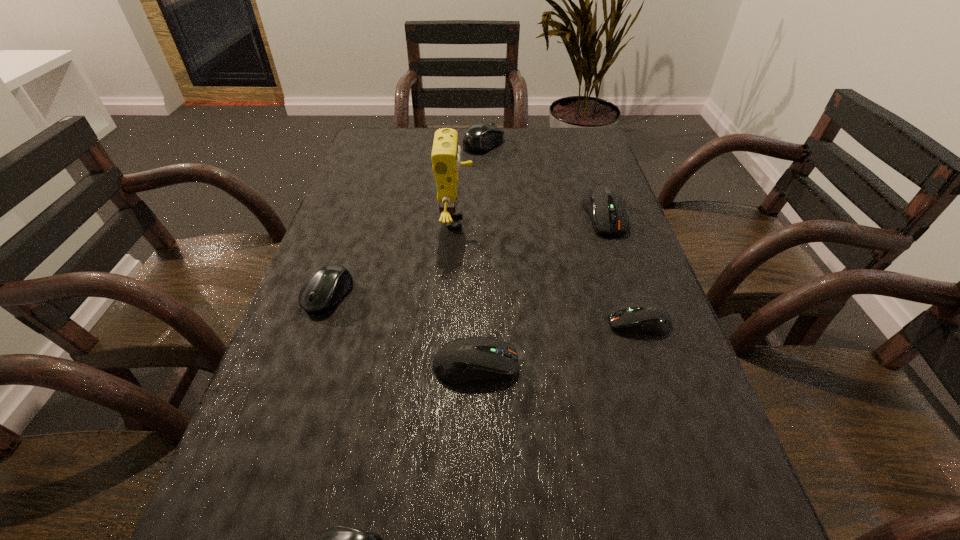
In order to click on sponge in this screenshot , I will do `click(446, 153)`.

Identify the location of the biggest black mouse. (480, 137).

This screenshot has height=540, width=960. What are the coordinates of `the farthest mouse` in the screenshot? It's located at [x=480, y=137].

Where is `the biggest dark computer equipment`? This screenshot has height=540, width=960. the biggest dark computer equipment is located at coordinates (606, 207).

You are a GUI agent. You are given a task and a screenshot of the screen. Output one action in this format:
    pyautogui.click(x=<x>, y=<y>)
    Task: Click on the farthest dark computer equipment
    Image resolution: width=960 pixels, height=540 pixels.
    Given the screenshot: What is the action you would take?
    pyautogui.click(x=606, y=207)

The image size is (960, 540). Find the location of `the second biggest black mouse`. the second biggest black mouse is located at coordinates (326, 287).

At what (x,y) coordinates should I click in order to perform the action: click on the leftmost mouse. Please return your answer as a coordinate pair (x, y). Image resolution: width=960 pixels, height=540 pixels. Looking at the image, I should click on (326, 287).

Find the location of a particular element. The height and width of the screenshot is (540, 960). the second biggest dark computer equipment is located at coordinates (463, 360).

What are the coordinates of `the nearest dark computer equipment` in the screenshot? It's located at (463, 360).

Image resolution: width=960 pixels, height=540 pixels. I want to click on the smallest dark computer equipment, so click(x=645, y=317).